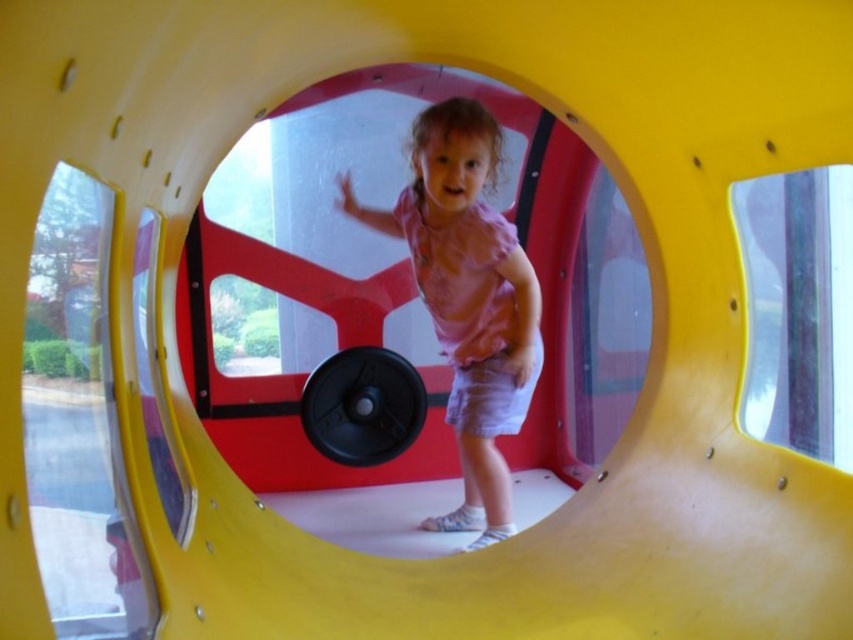
Question: Does pink fabric dress at center have a greater width compared to black rubber barbell at center?

Choices:
 (A) yes
 (B) no

Answer: (A)

Question: Which point is closer to the camera?

Choices:
 (A) (508, 376)
 (B) (389, 397)

Answer: (A)

Question: Can you confirm if pink fabric dress at center is positioned to the right of black rubber barbell at center?

Choices:
 (A) yes
 (B) no

Answer: (A)

Question: Observing the image, what is the correct spatial positioning of pink fabric dress at center in reference to black rubber barbell at center?

Choices:
 (A) right
 (B) left

Answer: (A)

Question: Which of the following is the farthest from the observer?

Choices:
 (A) black rubber barbell at center
 (B) pink fabric dress at center

Answer: (A)